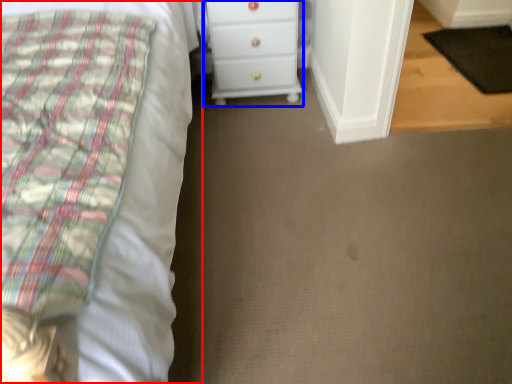
Question: Which object is closer to the camera taking this photo, bed (highlighted by a red box) or chest of drawers (highlighted by a blue box)?

Choices:
 (A) bed
 (B) chest of drawers

Answer: (A)